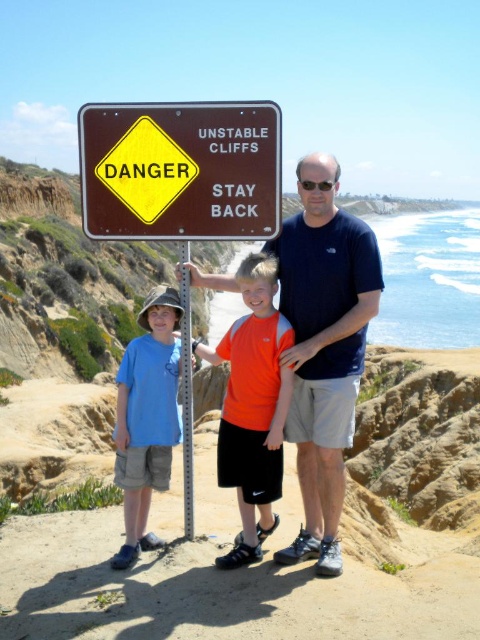
Can you confirm if orange matte shirt at center is positioned to the right of blue cotton shirt at center?

Yes, orange matte shirt at center is to the right of blue cotton shirt at center.

Consider the image. Can you confirm if orange matte shirt at center is bigger than blue cotton shirt at center?

Incorrect, orange matte shirt at center is not larger than blue cotton shirt at center.

Does point (248, 282) come closer to viewer compared to point (124, 451)?

Yes, it is.

Locate an element on the screen. The width and height of the screenshot is (480, 640). orange matte shirt at center is located at coordinates (252, 404).

Can you confirm if brown wooden sign at upper center is smaller than blue cotton shirt at center?

No, brown wooden sign at upper center is not smaller than blue cotton shirt at center.

Between point (215, 131) and point (129, 369), which one is positioned behind?

The point (129, 369) is more distant.

The height and width of the screenshot is (640, 480). I want to click on brown wooden sign at upper center, so click(180, 170).

Between dark blue t-shirt at center and blue cotton shirt at center, which one appears on the right side from the viewer's perspective?

Positioned to the right is dark blue t-shirt at center.

Is point (316, 364) farther from viewer compared to point (162, 346)?

Yes, point (316, 364) is behind point (162, 346).

Locate an element on the screen. The width and height of the screenshot is (480, 640). dark blue t-shirt at center is located at coordinates (324, 346).